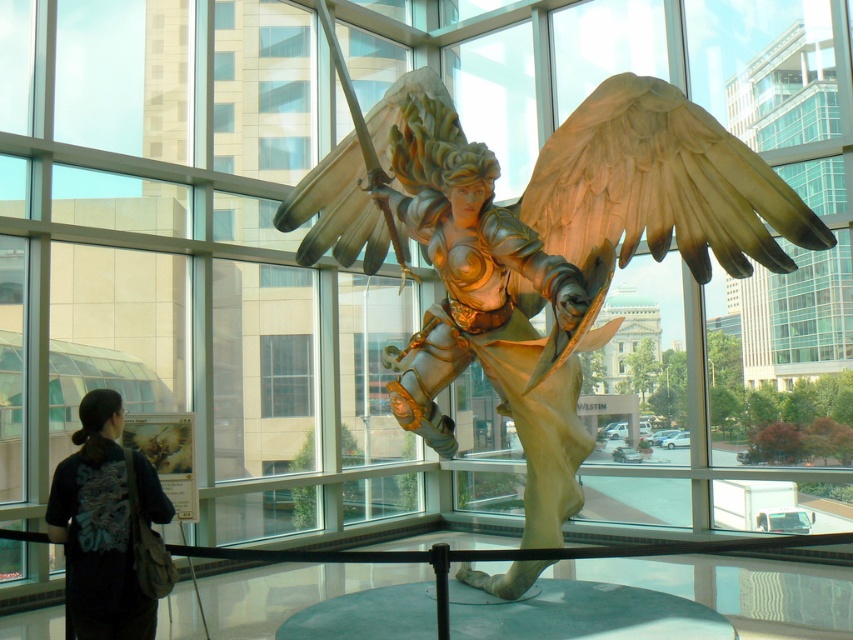
Who is shorter, bronze statue at center or black fabric bag at lower left?

With less height is black fabric bag at lower left.

Which is more to the left, bronze statue at center or black fabric bag at lower left?

black fabric bag at lower left

What do you see at coordinates (538, 248) in the screenshot? Image resolution: width=853 pixels, height=640 pixels. I see `bronze statue at center` at bounding box center [538, 248].

Locate an element on the screen. The image size is (853, 640). bronze statue at center is located at coordinates (538, 248).